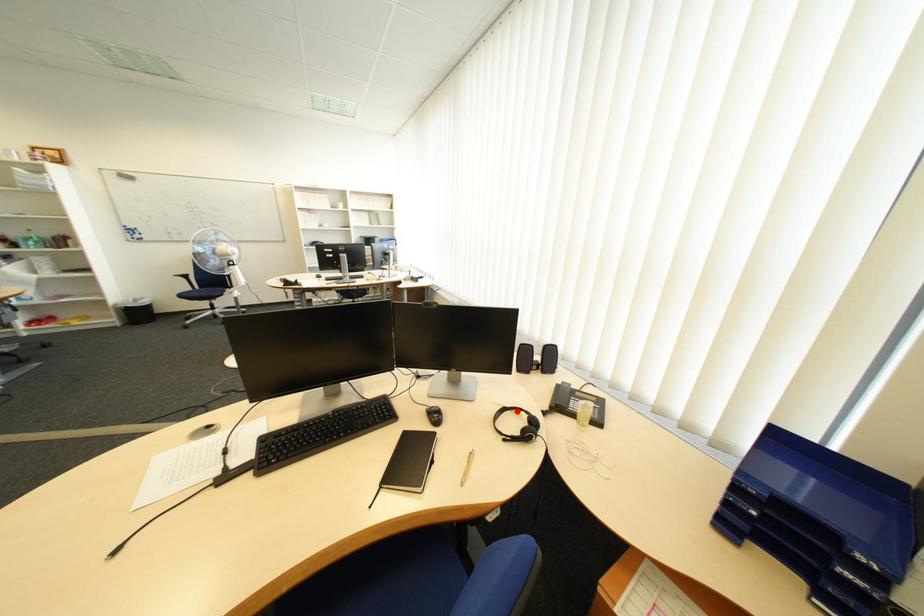
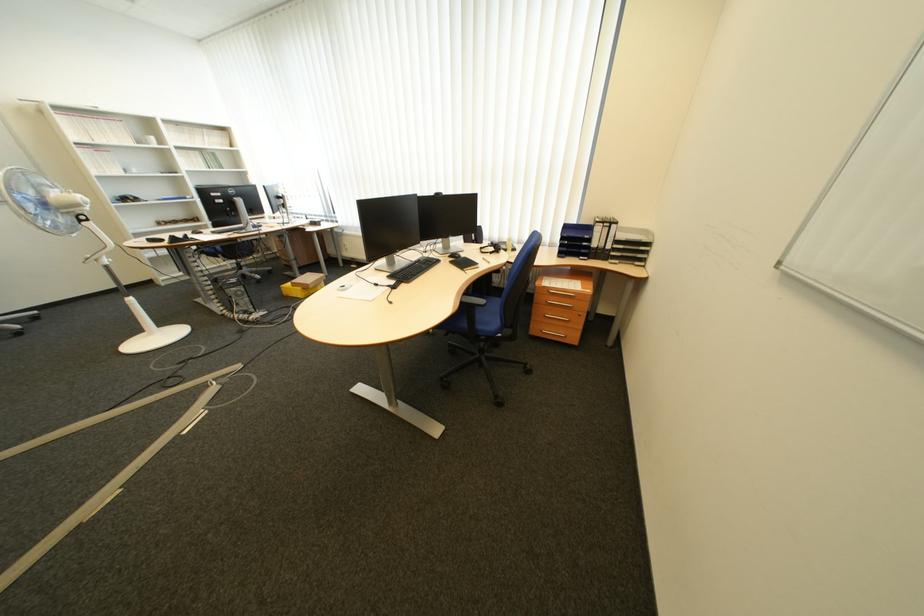
Question: I am providing you with two images of the same scene from different viewpoints. Given a red point in image1, look at the same physical point in image2. Is it:

Choices:
 (A) Closer to the viewpoint
 (B) Farther from the viewpoint

Answer: (A)